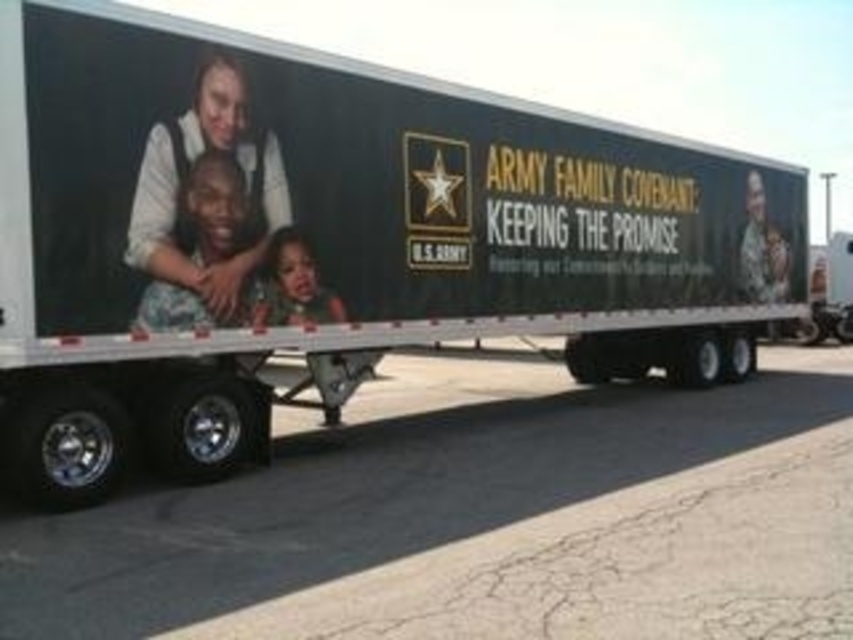
Question: From the image, what is the correct spatial relationship of matte black uniform at center in relation to smooth skin child at center?

Choices:
 (A) below
 (B) above

Answer: (B)

Question: Which of the following is the closest to the observer?

Choices:
 (A) smooth skin child at center
 (B) matte black uniform at center

Answer: (B)

Question: Which point is farther to the camera?

Choices:
 (A) smooth skin child at center
 (B) matte black uniform at center

Answer: (A)

Question: Is matte black uniform at center positioned before smooth skin child at center?

Choices:
 (A) yes
 (B) no

Answer: (A)

Question: Which object appears farthest from the camera in this image?

Choices:
 (A) matte black uniform at center
 (B) smooth skin child at center

Answer: (B)

Question: Is matte black uniform at center to the left of smooth skin child at center from the viewer's perspective?

Choices:
 (A) no
 (B) yes

Answer: (B)